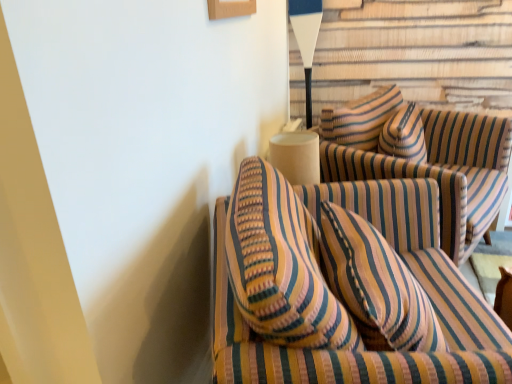
Question: Is striped fabric couch at center, which is the 1th studio couch in front-to-back order, to the left of striped fabric couch at center, the first studio couch viewed from the back, from the viewer's perspective?

Choices:
 (A) yes
 (B) no

Answer: (A)

Question: From a real-world perspective, is striped fabric couch at center, placed as the 2th studio couch when sorted from back to front, on top of striped fabric couch at center, the first studio couch viewed from the back?

Choices:
 (A) no
 (B) yes

Answer: (A)

Question: Is striped fabric couch at center, which is the 1th studio couch in front-to-back order, turned away from striped fabric couch at center, the second studio couch viewed from the front?

Choices:
 (A) yes
 (B) no

Answer: (B)

Question: Does striped fabric couch at center, which is the 1th studio couch in front-to-back order, lie behind striped fabric couch at center, the first studio couch viewed from the back?

Choices:
 (A) no
 (B) yes

Answer: (A)

Question: Does striped fabric couch at center, which is the 1th studio couch in front-to-back order, come in front of striped fabric couch at center, the first studio couch viewed from the back?

Choices:
 (A) no
 (B) yes

Answer: (B)

Question: Looking at the image, does white matte table lamp at upper center seem bigger or smaller compared to striped fabric couch at center, the second studio couch viewed from the front?

Choices:
 (A) small
 (B) big

Answer: (A)

Question: Is point (315, 16) positioned closer to the camera than point (479, 177)?

Choices:
 (A) closer
 (B) farther

Answer: (B)

Question: Relative to striped fabric couch at center, the first studio couch viewed from the back, is white matte table lamp at upper center in front or behind?

Choices:
 (A) front
 (B) behind

Answer: (B)

Question: From a real-world perspective, is white matte table lamp at upper center physically located above or below striped fabric couch at center, the first studio couch viewed from the back?

Choices:
 (A) below
 (B) above

Answer: (B)

Question: Considering the positions of point (463, 162) and point (290, 19), is point (463, 162) closer or farther from the camera than point (290, 19)?

Choices:
 (A) farther
 (B) closer

Answer: (B)

Question: Is striped fabric couch at center, the first studio couch viewed from the back, inside or outside of white matte table lamp at upper center?

Choices:
 (A) inside
 (B) outside

Answer: (B)

Question: Looking at the image, does striped fabric couch at center, the first studio couch viewed from the back, seem bigger or smaller compared to white matte table lamp at upper center?

Choices:
 (A) big
 (B) small

Answer: (A)

Question: From the image's perspective, is striped fabric couch at center, the first studio couch viewed from the back, located above or below white matte table lamp at upper center?

Choices:
 (A) above
 (B) below

Answer: (B)

Question: Is striped fabric couch at center, the first studio couch viewed from the back, to the left or to the right of striped fabric couch at center, which is the 1th studio couch in front-to-back order, in the image?

Choices:
 (A) right
 (B) left

Answer: (A)

Question: Considering the positions of striped fabric couch at center, the second studio couch viewed from the front, and striped fabric couch at center, which is the 1th studio couch in front-to-back order, in the image, is striped fabric couch at center, the second studio couch viewed from the front, wider or thinner than striped fabric couch at center, which is the 1th studio couch in front-to-back order,?

Choices:
 (A) thin
 (B) wide

Answer: (A)